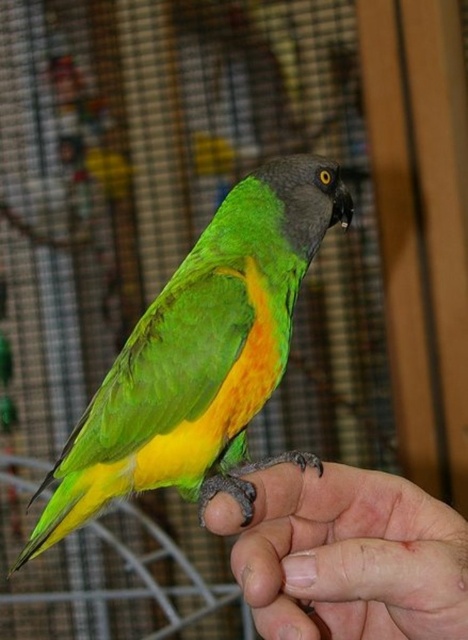
Is point (176, 388) farther from camera compared to point (286, 538)?

Yes, point (176, 388) is farther from viewer.

Is point (184, 492) positioned before point (399, 573)?

That is False.

Identify the location of green matte parrot at center. The image size is (468, 640). (202, 356).